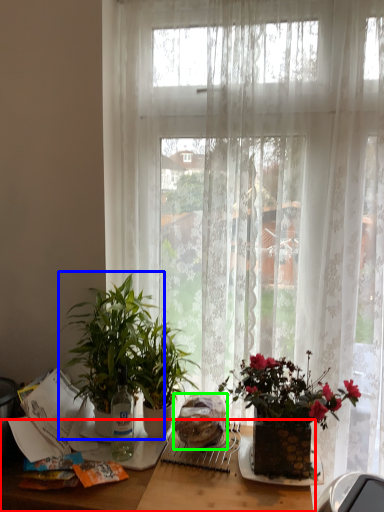
Question: Considering the real-world distances, which object is closest to table (highlighted by a red box)? houseplant (highlighted by a blue box) or food (highlighted by a green box).

Choices:
 (A) houseplant
 (B) food

Answer: (B)